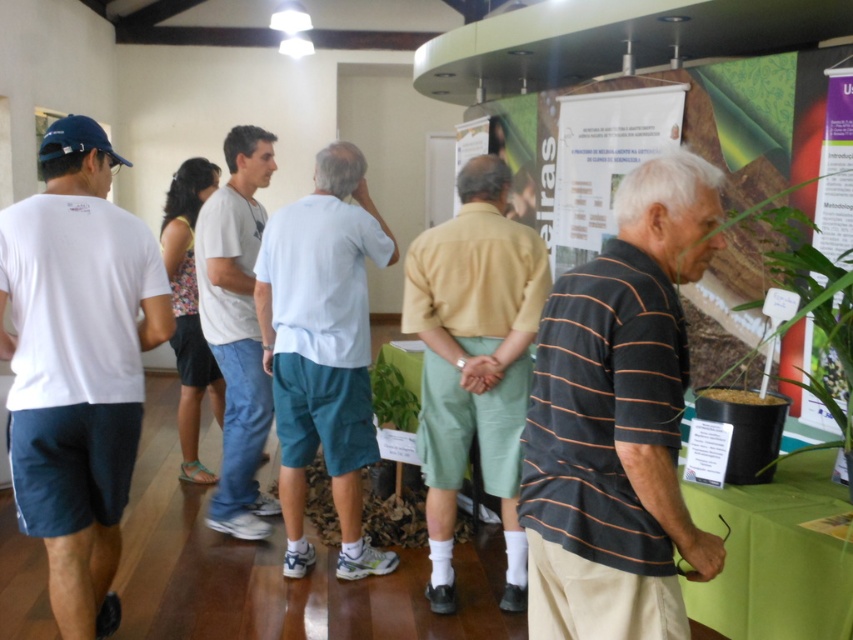
Can you confirm if white cotton shirt at center is bigger than green leafy plant at center?

Correct, white cotton shirt at center is larger in size than green leafy plant at center.

You are a GUI agent. You are given a task and a screenshot of the screen. Output one action in this format:
    pyautogui.click(x=<x>, y=<y>)
    Task: Click on the white cotton shirt at center
    This screenshot has width=853, height=640.
    Given the screenshot: What is the action you would take?
    pyautogui.click(x=323, y=349)

Is white cotton shirt at center positioned in front of light gray cotton t-shirt at center?

Yes, white cotton shirt at center is in front of light gray cotton t-shirt at center.

Which is above, white cotton shirt at center or light gray cotton t-shirt at center?

Positioned higher is light gray cotton t-shirt at center.

Is point (271, 369) farther from camera compared to point (219, 266)?

No, it is not.

This screenshot has width=853, height=640. In order to click on white cotton shirt at center in this screenshot , I will do `click(323, 349)`.

Who is taller, white cotton shirt at center or green matte poster at upper right?

white cotton shirt at center is taller.

Does point (302, 340) come closer to viewer compared to point (834, 76)?

No, (302, 340) is behind (834, 76).

I want to click on white cotton shirt at center, so (323, 349).